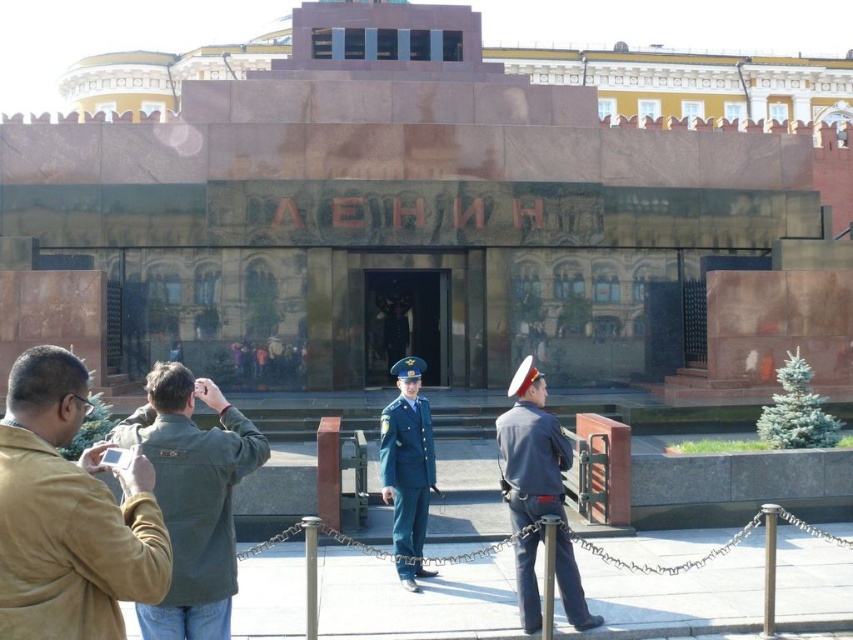
Is dark green jacket at center taller than green fabric uniform at center?

Yes, dark green jacket at center is taller than green fabric uniform at center.

Between dark green jacket at center and green fabric uniform at center, which one appears on the right side from the viewer's perspective?

Positioned to the right is green fabric uniform at center.

Is point (231, 484) farther from camera compared to point (379, 458)?

No.

This screenshot has height=640, width=853. What are the coordinates of `dark green jacket at center` in the screenshot? It's located at (192, 497).

Can you confirm if tan suede jacket at lower left is smaller than dark green jacket at center?

Yes.

The image size is (853, 640). Find the location of `tan suede jacket at lower left`. tan suede jacket at lower left is located at coordinates (68, 515).

I want to click on tan suede jacket at lower left, so click(x=68, y=515).

Which is above, brown polished stone monument at center or dark blue uniform at center?

brown polished stone monument at center

Who is shorter, brown polished stone monument at center or dark blue uniform at center?

With less height is dark blue uniform at center.

Which is in front, point (218, 83) or point (520, 563)?

Positioned in front is point (520, 563).

Where is `brown polished stone monument at center`? The height and width of the screenshot is (640, 853). brown polished stone monument at center is located at coordinates (422, 216).